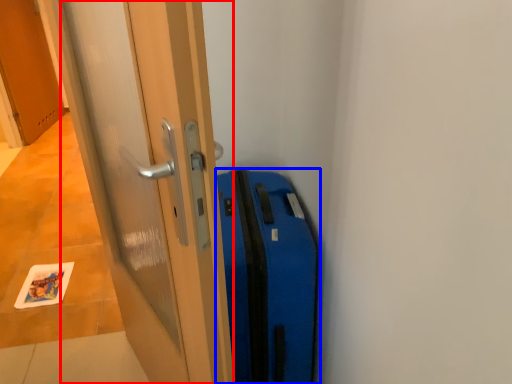
Question: Which object appears closest to the camera in this image, door (highlighted by a red box) or suitcase (highlighted by a blue box)?

Choices:
 (A) door
 (B) suitcase

Answer: (A)